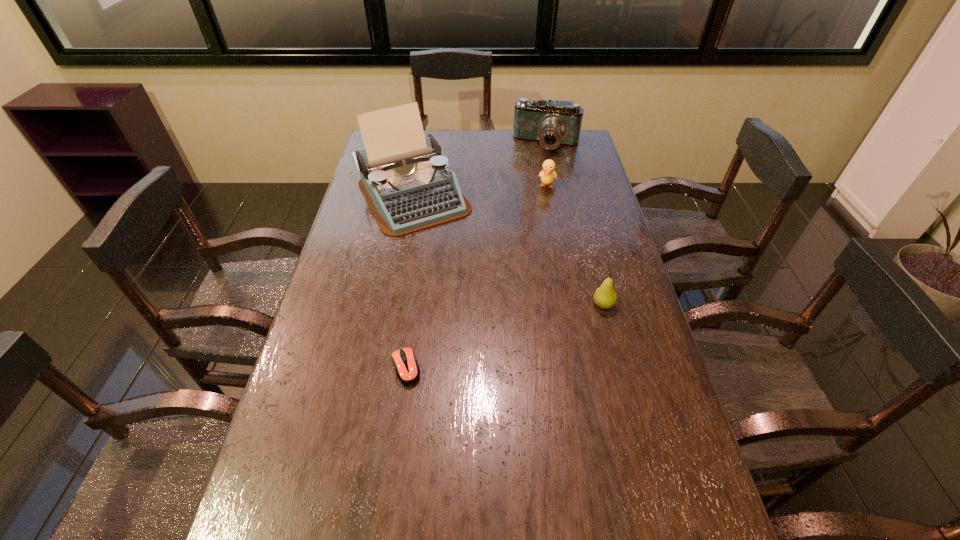
I want to click on empty space that is in between the second nearest object and the camcorder, so click(x=575, y=225).

The width and height of the screenshot is (960, 540). What are the coordinates of `vacant space that's between the tallest object and the fourth shortest object` in the screenshot? It's located at (480, 170).

Where is `vacant space in between the shortest object and the duckling`? vacant space in between the shortest object and the duckling is located at coordinates (476, 276).

Find the location of `object that is the fourth closest to the camcorder`. object that is the fourth closest to the camcorder is located at coordinates (407, 369).

Point out which object is positioned as the second nearest to the typewriter. Please provide its 2D coordinates. Your answer should be formatted as a tuple, i.e. [(x, y)], where the tuple contains the x and y coordinates of a point satisfying the conditions above.

[(548, 174)]

Locate an element on the screen. The height and width of the screenshot is (540, 960). vacant area in the image that satisfies the following two spatial constraints: 1. on the back side of the farthest object; 2. on the left side of the nearest object is located at coordinates (436, 144).

This screenshot has height=540, width=960. I want to click on free region that satisfies the following two spatial constraints: 1. on the front side of the typewriter; 2. on the right side of the fourth farthest object, so tap(395, 305).